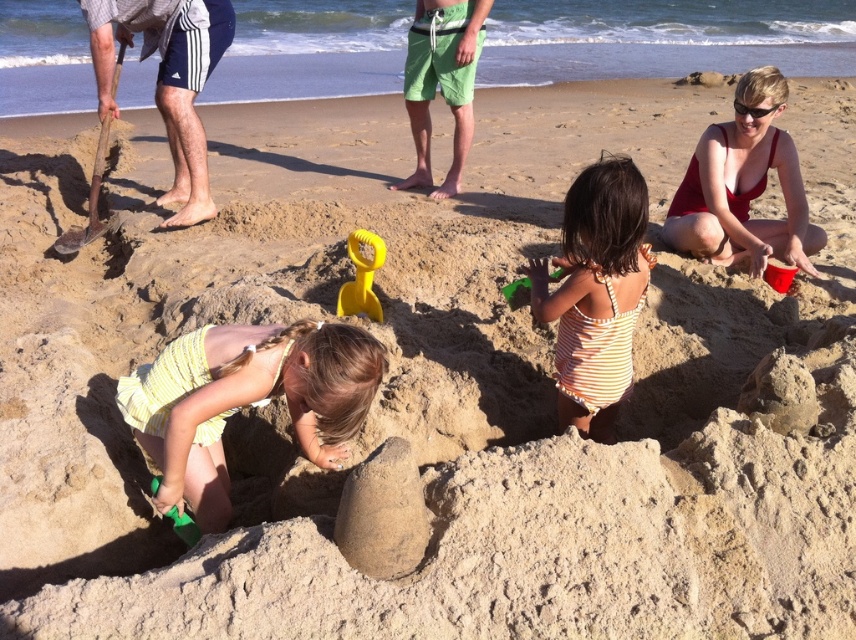
Based on the photo, you are a photographer trying to capture a photo of the green plastic shovel at lower left without the matte red swimsuit at upper right blocking it. Based on their positions, is this possible?

The matte red swimsuit at upper right is positioned over the green plastic shovel at lower left, so it would block the shovel. To avoid the red swimsuit blocking the shovel, the photographer needs to adjust their angle or position to ensure the red swimsuit is not directly above the shovel in the frame.

You are a photographer trying to capture a group photo of the yellow striped swimsuit at center and the matte red swimsuit at upper right. Based on their sizes in the image, which one should you focus on first to ensure both fit in the frame?

The yellow striped swimsuit at center occupies less space than the matte red swimsuit at upper right, so you should focus on the matte red swimsuit at upper right first to ensure both fit in the frame.

You are a beach photographer wanting to capture a closeup of the striped cotton swimsuit at center and the green plastic shovel at lower left. Since you want both items to appear the same size in the photo, which object should you move closer to the camera?

The striped cotton swimsuit at center is larger in size compared to the green plastic shovel at lower left. To make them appear the same size in the photo, you should move the striped cotton swimsuit at center farther away from the camera and the green plastic shovel at lower left closer to the camera.